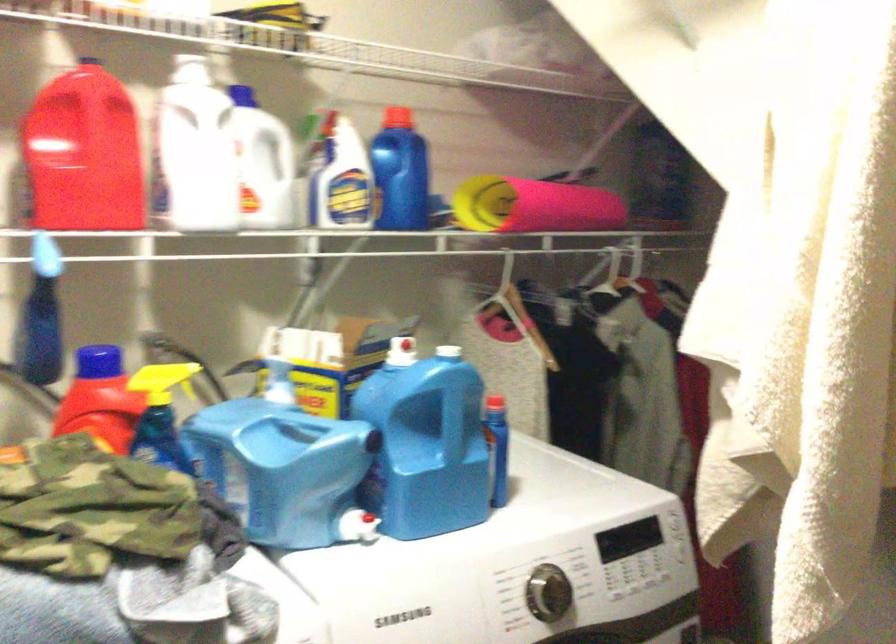
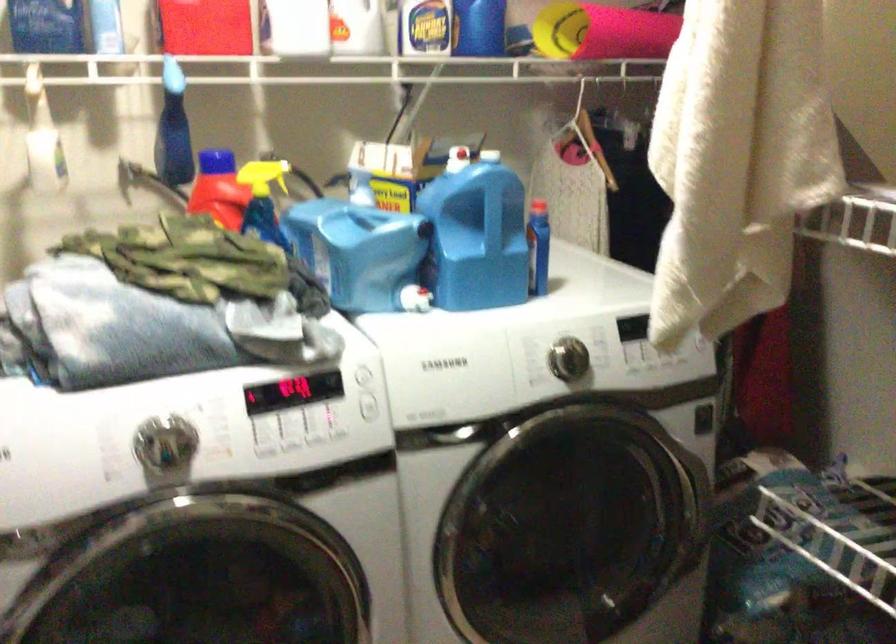
Locate, in the second image, the point that corresponds to [532,202] in the first image.

(602, 32)